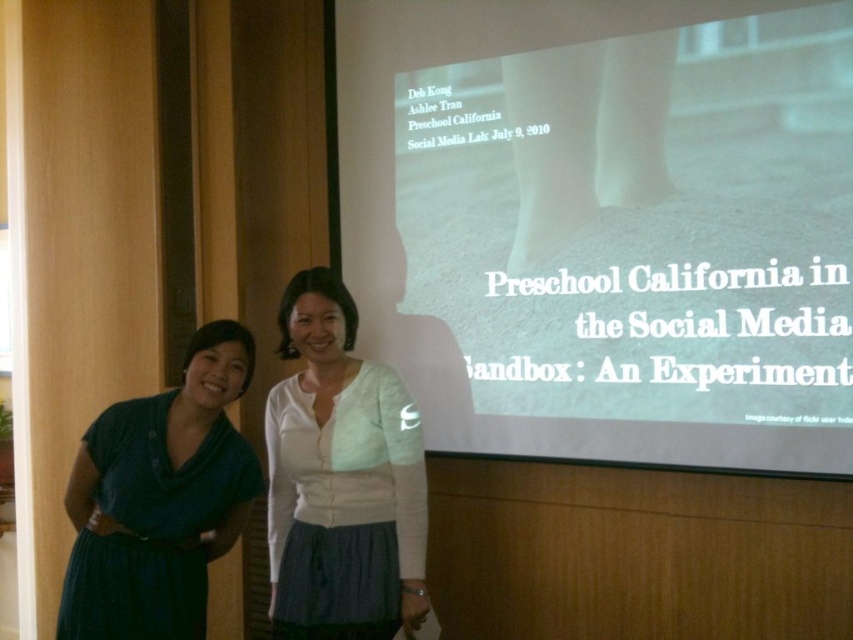
Question: Considering the relative positions of white matte blouse at center and dark blue fabric dress at left in the image provided, where is white matte blouse at center located with respect to dark blue fabric dress at left?

Choices:
 (A) left
 (B) right

Answer: (B)

Question: Can you confirm if white matte projection screen at upper center is thinner than white matte blouse at center?

Choices:
 (A) no
 (B) yes

Answer: (A)

Question: Which object is farther from the camera taking this photo?

Choices:
 (A) dark blue fabric dress at left
 (B) white matte blouse at center
 (C) white matte projection screen at upper center

Answer: (C)

Question: Is white matte projection screen at upper center smaller than white matte blouse at center?

Choices:
 (A) no
 (B) yes

Answer: (A)

Question: Considering the real-world distances, which object is farthest from the dark blue fabric dress at left?

Choices:
 (A) white matte projection screen at upper center
 (B) white matte blouse at center

Answer: (A)

Question: Which object is closer to the camera taking this photo?

Choices:
 (A) dark blue fabric dress at left
 (B) white matte blouse at center
 (C) white matte projection screen at upper center

Answer: (A)